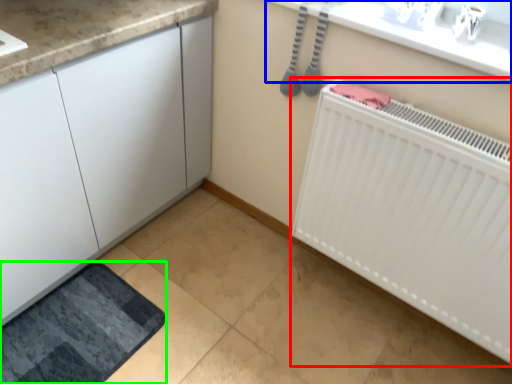
Question: Which is nearer to the radiator (highlighted by a red box)? counter top (highlighted by a blue box) or bath mat (highlighted by a green box).

Choices:
 (A) counter top
 (B) bath mat

Answer: (A)